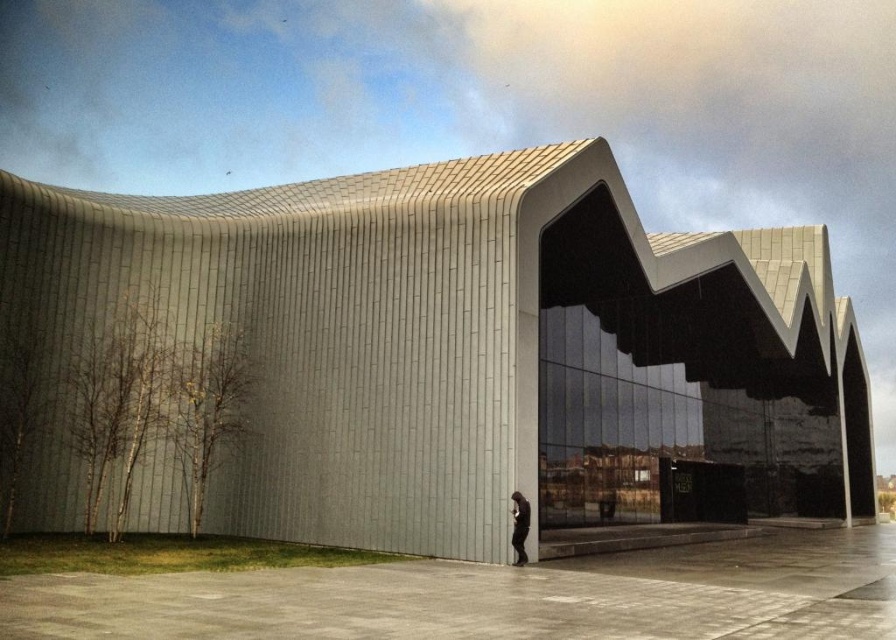
Can you confirm if sleek concrete building at center is positioned to the left of dark gray fabric person at lower center?

In fact, sleek concrete building at center is to the right of dark gray fabric person at lower center.

Identify the location of sleek concrete building at center. The image size is (896, 640). (420, 362).